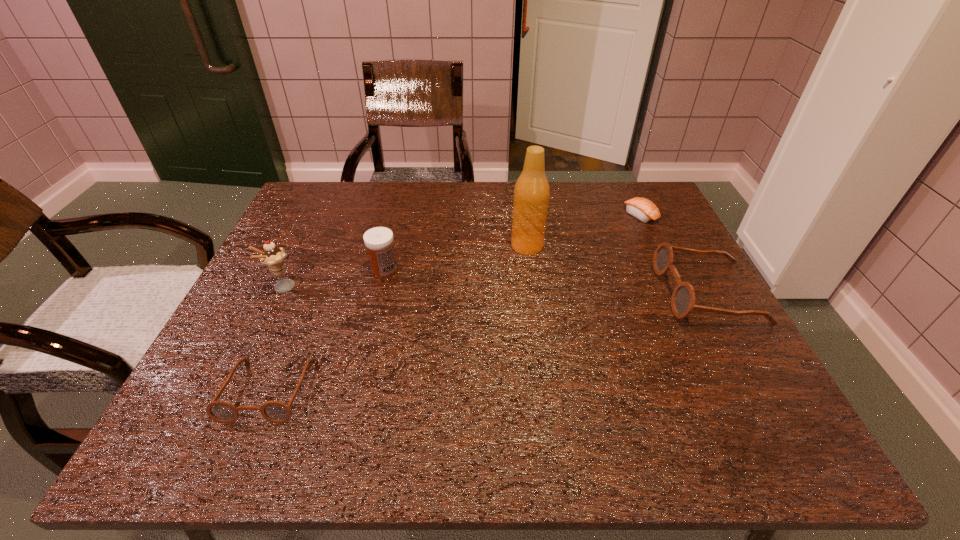
The image size is (960, 540). I want to click on vacant area at the far right corner, so click(630, 193).

Where is `free spot between the right spectacles and the fourth shortest object`? free spot between the right spectacles and the fourth shortest object is located at coordinates (546, 281).

Image resolution: width=960 pixels, height=540 pixels. Find the location of `free space between the fifth nearest object and the farther spectacles`. free space between the fifth nearest object and the farther spectacles is located at coordinates (618, 269).

The image size is (960, 540). Identify the location of free spot between the third shortest object and the farthest object. (675, 254).

Locate an element on the screen. The image size is (960, 540). vacant area between the third object from left to right and the farther spectacles is located at coordinates (546, 281).

This screenshot has height=540, width=960. Identify the location of free area in between the third object from left to right and the beer bottle. (456, 258).

Image resolution: width=960 pixels, height=540 pixels. In order to click on free space between the fifth nearest object and the fourth object from right to left in this screenshot , I will do `click(456, 258)`.

This screenshot has height=540, width=960. Identify the location of free space between the second farthest object and the left spectacles. (397, 318).

Where is `vacant area that lies between the sushi and the left spectacles`? vacant area that lies between the sushi and the left spectacles is located at coordinates (454, 302).

Image resolution: width=960 pixels, height=540 pixels. What are the coordinates of `vacant region between the shortest object and the left spectacles` in the screenshot? It's located at (454, 302).